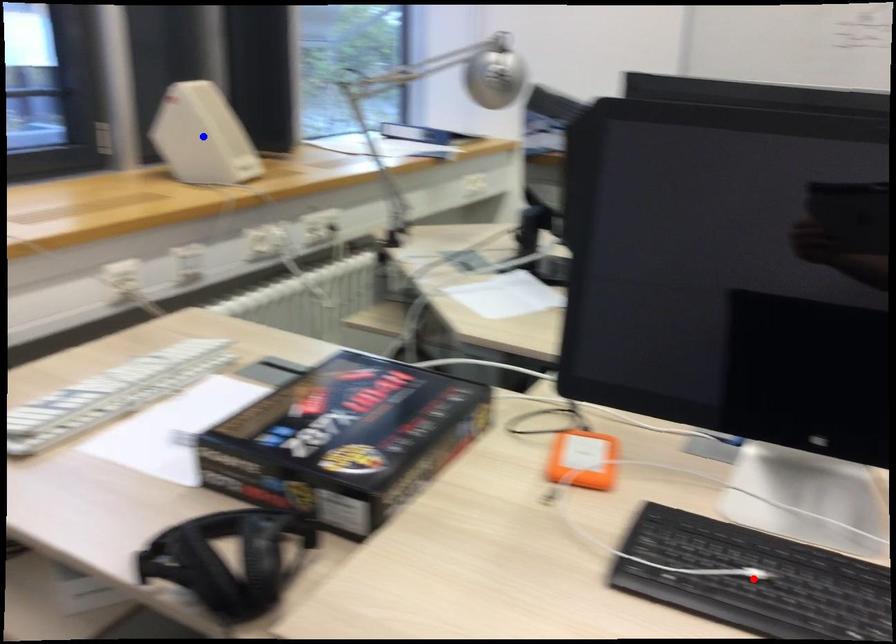
Question: Two points are marked on the image. Which point is closer to the camera?

Choices:
 (A) Blue point is closer.
 (B) Red point is closer.

Answer: (B)